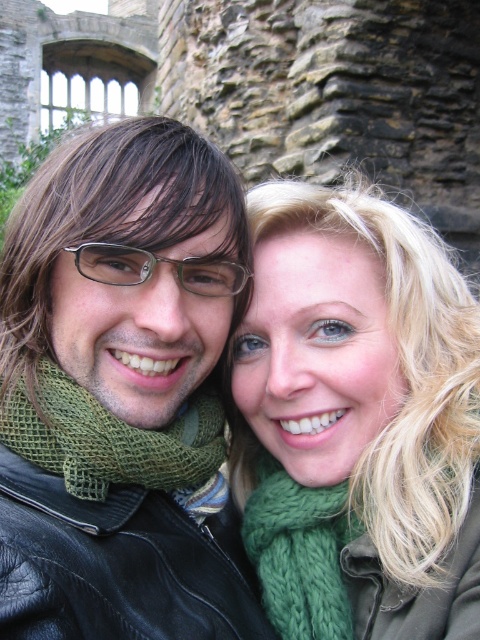
You are a photographer adjusting the camera focus. You notice two points in the frame at coordinates point (x=143, y=467) and point (x=191, y=289). Which point should you focus on first if you want to ensure the person closer to the camera is in sharp focus?

Point (x=143, y=467) should be focused on first because it is in front of point (x=191, y=289), meaning the person closer to the camera is at that coordinate.

You are a photographer adjusting your camera settings. You notice the green knitted scarf at lower right and the clear plastic glasses at center in your frame. Which object should you focus on first if you want to ensure both are in sharp focus?

You should focus on the green knitted scarf at lower right first because it is closer to the viewer than the clear plastic glasses at center, ensuring the closer object is in focus before adjusting for the farther one.

You are standing in front of the stone structure and want to determine which of the two points, point [400,220] or point [324,577], is closer to you. Based on the image, which point is nearer?

Point [400,220] is further to the viewer than point [324,577], so the closer point to you is point [324,577].